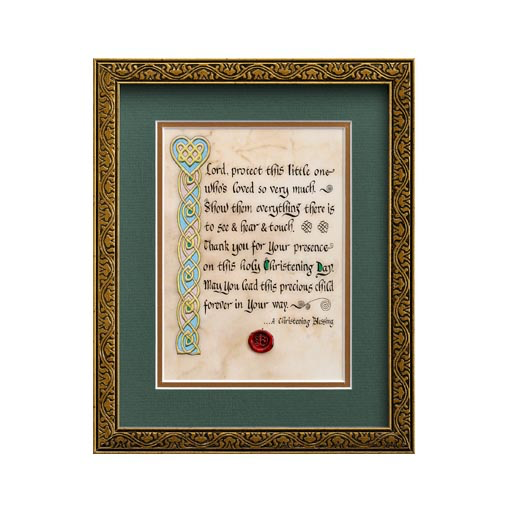
You are a GUI agent. You are given a task and a screenshot of the screen. Output one action in this format:
    pyautogui.click(x=<x>, y=<y>)
    Task: Click on the frame
    
    Given the screenshot: What is the action you would take?
    pyautogui.click(x=142, y=442)